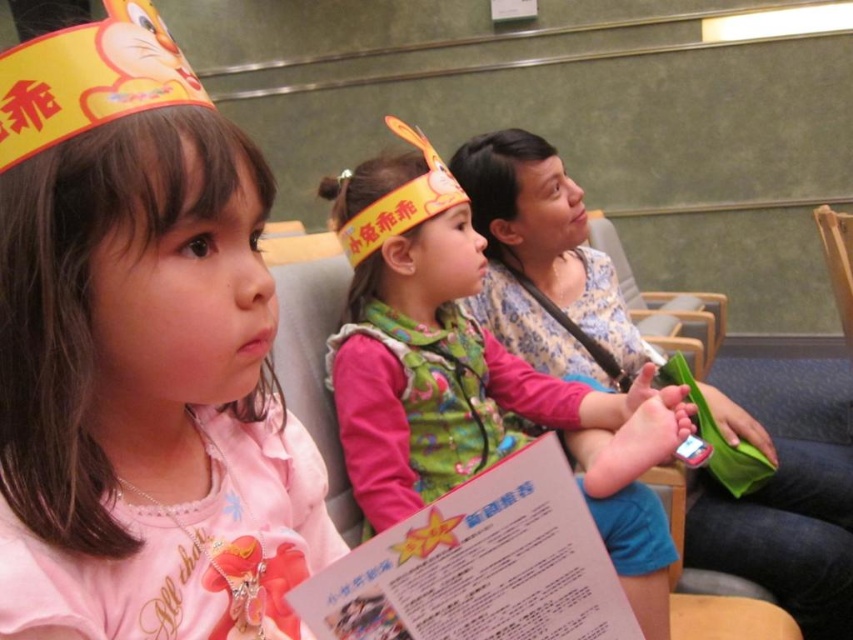
Measure the distance between pink fabric shirt at center and camera.

pink fabric shirt at center is 37.74 centimeters away from camera.

Is pink fabric shirt at center in front of matte pink shirt at center?

Yes, it is.

Is point (189, 595) farther from viewer compared to point (425, 460)?

That is False.

You are a GUI agent. You are given a task and a screenshot of the screen. Output one action in this format:
    pyautogui.click(x=<x>, y=<y>)
    Task: Click on the pink fabric shirt at center
    The width and height of the screenshot is (853, 640).
    Given the screenshot: What is the action you would take?
    pyautogui.click(x=140, y=355)